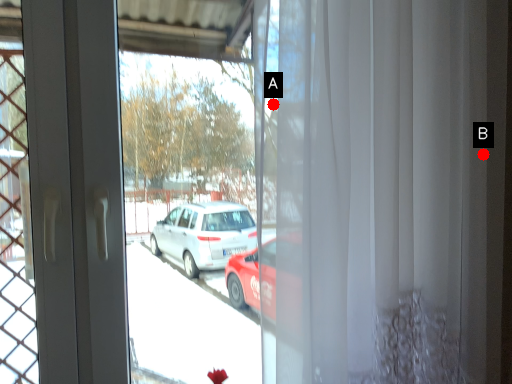
Question: Two points are circled on the image, labeled by A and B beside each circle. Which point is farther from the camera taking this photo?

Choices:
 (A) A is further
 (B) B is further

Answer: (B)